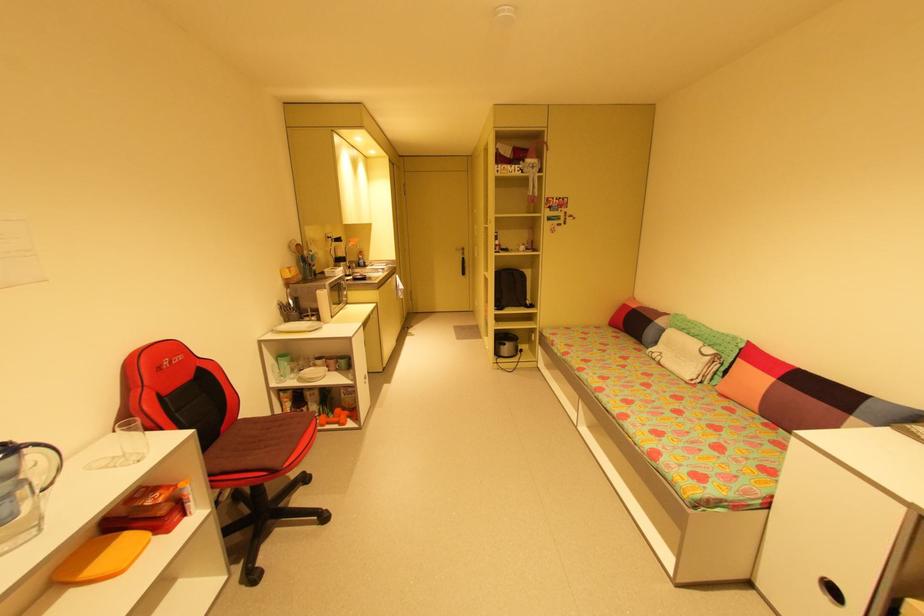
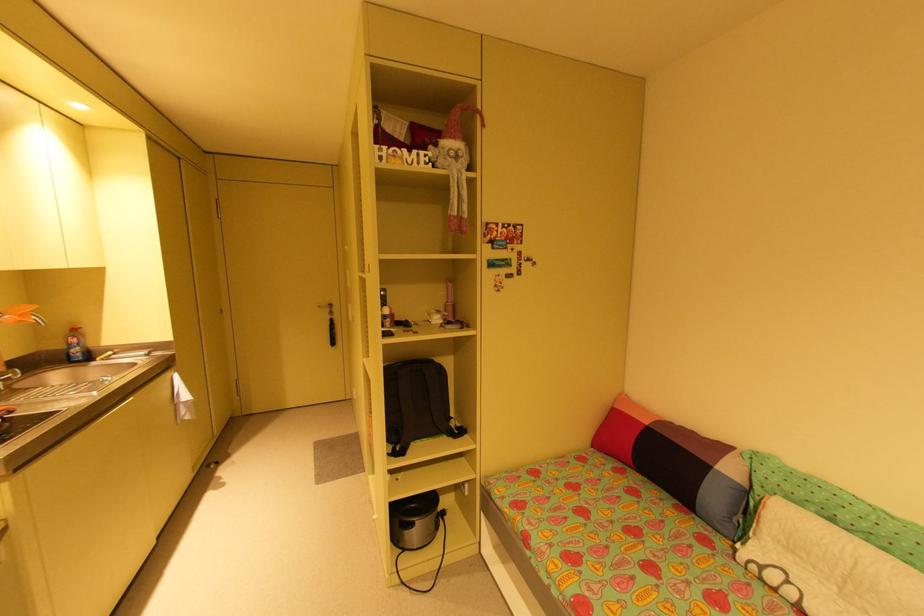
The point at (536, 306) is marked in the first image. Where is the corresponding point in the second image?

(466, 431)